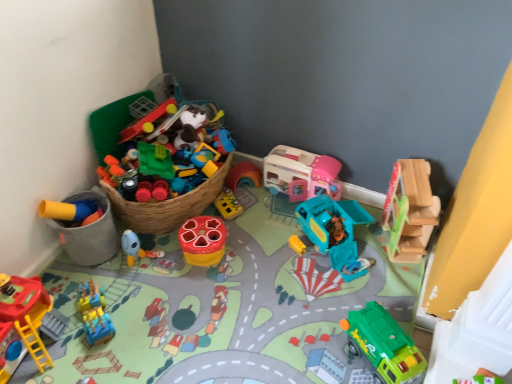
Locate an element on the screen. vacant space in front of rubberized yellow toy at left, marked as the 1th toy in a left-to-right arrangement is located at coordinates (85, 284).